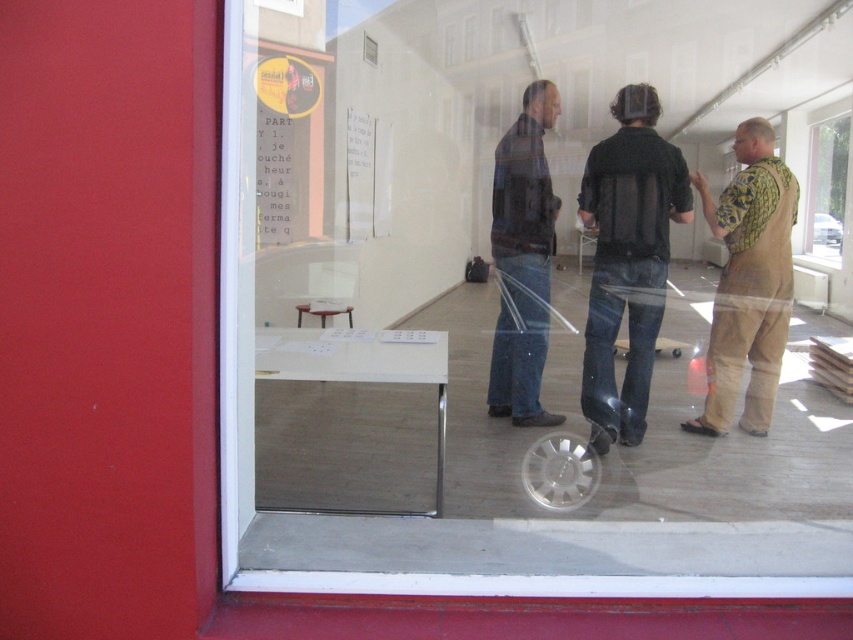
Is camouflage shirt at right closer to camera compared to transparent glass window at upper right?

Yes.

Which is more to the left, camouflage shirt at right or transparent glass window at upper right?

From the viewer's perspective, camouflage shirt at right appears more on the left side.

Measure the distance between point (766,154) and camera.

Point (766,154) is 13.05 feet away from camera.

Locate an element on the screen. The width and height of the screenshot is (853, 640). camouflage shirt at right is located at coordinates (747, 282).

Can you confirm if transparent glass at center is thinner than black matte vest at center?

In fact, transparent glass at center might be wider than black matte vest at center.

Who is more distant from viewer, (376, 538) or (624, 273)?

The point (624, 273) is behind.

Where is `transparent glass at center`? transparent glass at center is located at coordinates (486, 330).

Is the position of dark blue jeans at center less distant than that of transparent glass window at upper right?

Yes.

Looking at this image, does dark blue jeans at center appear under transparent glass window at upper right?

Indeed, dark blue jeans at center is positioned under transparent glass window at upper right.

What are the coordinates of `dark blue jeans at center` in the screenshot? It's located at [x=521, y=260].